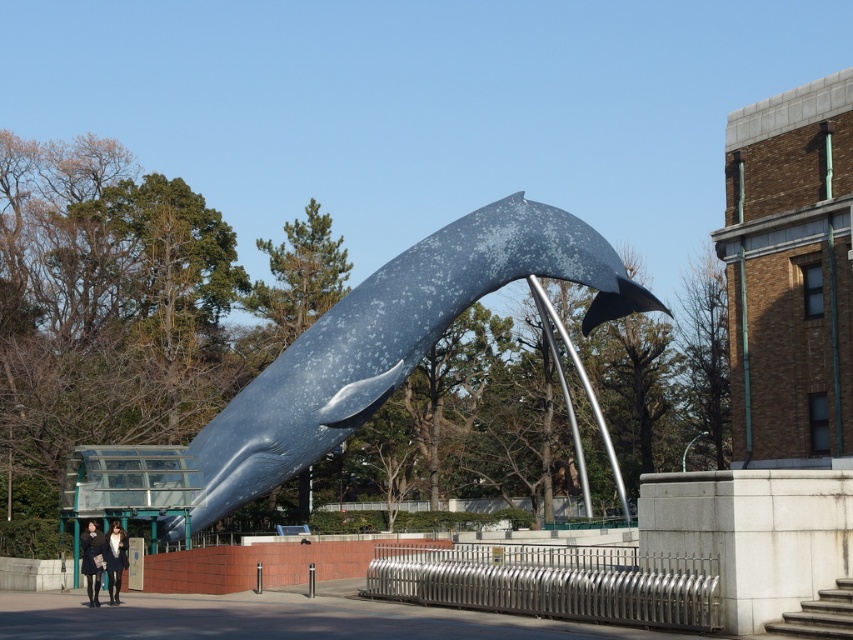
Based on the photo, you are a delivery person who needs to place a package between the black wool coat at lower left and the matte black coat at lower left. Can you fit the package, which is 3.5 meters long, in the space between them?

The distance between the black wool coat at lower left and the matte black coat at lower left is 3.30 meters. Since the package is 3.5 meters long, it is longer than the available space. Therefore, the package cannot fit between them.

You are an artist planning to create a miniature model of the speckled blue whale at center and the black wool coat at lower left. If you want both models to be proportional to their actual sizes, which object should you make larger in your model?

The speckled blue whale at center should be made larger in the model since its actual width is greater than that of the black wool coat at lower left.